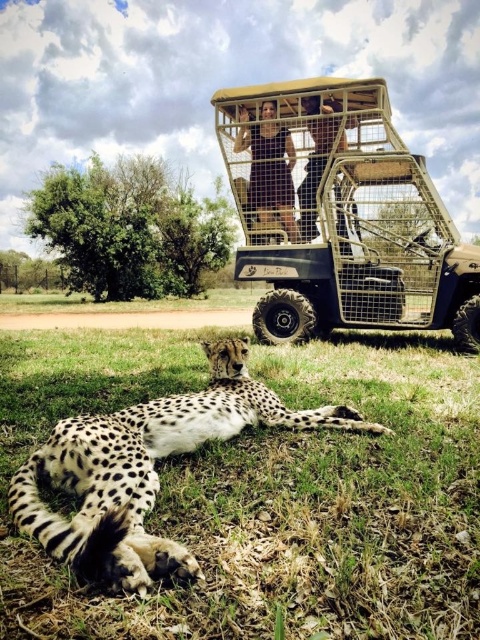
Question: Is spotted fur cheetah at lower left bigger than smooth skin person at center?

Choices:
 (A) no
 (B) yes

Answer: (B)

Question: In this image, where is dark brown fabric pants at center located relative to smooth skin person at center?

Choices:
 (A) above
 (B) below

Answer: (A)

Question: Which point is closer to the camera?

Choices:
 (A) (251, 144)
 (B) (317, 99)

Answer: (B)

Question: Does spotted fur cheetah at lower left have a smaller size compared to smooth skin person at center?

Choices:
 (A) yes
 (B) no

Answer: (B)

Question: Among these objects, which one is nearest to the camera?

Choices:
 (A) smooth skin person at center
 (B) spotted fur cheetah at lower left

Answer: (B)

Question: Which is nearer to the smooth skin person at center?

Choices:
 (A) dark brown fabric pants at center
 (B) spotted fur cheetah at lower left

Answer: (A)